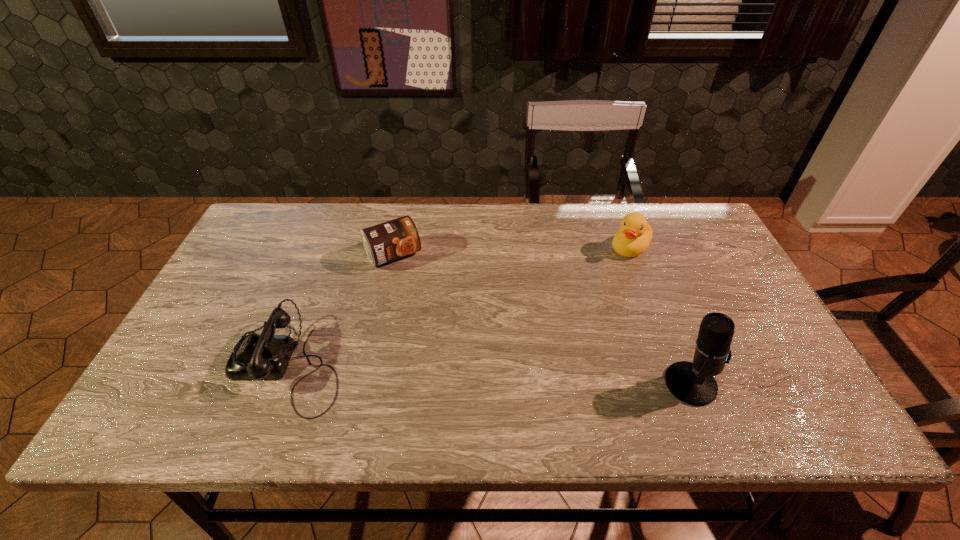
This screenshot has width=960, height=540. Identify the location of free spot on the desktop that is between the telephone and the microphone and is positioned at the beak of the third shortest object. (489, 374).

What are the coordinates of `free spot on the desktop that is between the telephone and the microphone and is positioned on the front label of the can` in the screenshot? It's located at (468, 373).